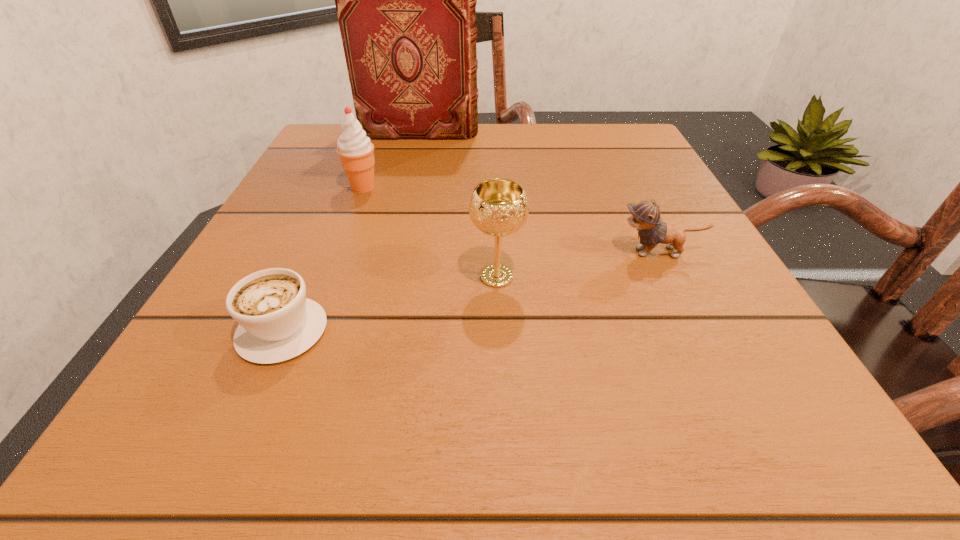
At what (x,y) coordinates should I click in order to perform the action: click on empty space that is in between the icecream and the chalice. Please return your answer as a coordinate pair (x, y). This screenshot has height=540, width=960. Looking at the image, I should click on (430, 232).

This screenshot has height=540, width=960. I want to click on free space between the rightmost object and the chalice, so click(x=578, y=265).

This screenshot has height=540, width=960. Identify the location of empty space between the chalice and the shortest object. (390, 303).

This screenshot has height=540, width=960. What are the coordinates of `free space between the chalice and the shortest object` in the screenshot? It's located at (390, 303).

Locate an element on the screen. The image size is (960, 540). empty location between the rightmost object and the cappuccino is located at coordinates (471, 291).

Identify the location of free space between the icecream and the shortest object. (324, 258).

Find the location of `empty location between the shortest object and the second shortest object`. empty location between the shortest object and the second shortest object is located at coordinates (471, 291).

Locate an element on the screen. This screenshot has width=960, height=540. free spot between the farthest object and the icecream is located at coordinates (392, 160).

This screenshot has height=540, width=960. What are the coordinates of `vacant region between the rightmost object and the chalice` in the screenshot? It's located at click(x=578, y=265).

Where is `free spot between the second shortest object and the cappuccino`? This screenshot has width=960, height=540. free spot between the second shortest object and the cappuccino is located at coordinates (471, 291).